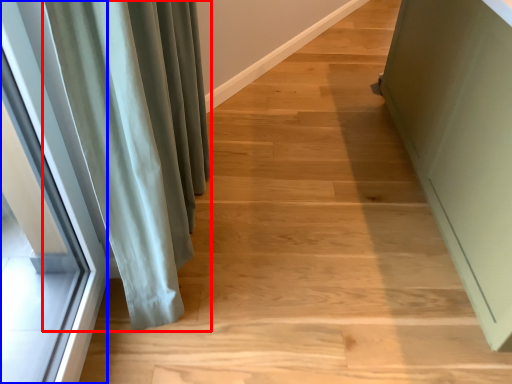
Question: Which of the following is the closest to the observer, curtain (highlighted by a red box) or window (highlighted by a blue box)?

Choices:
 (A) curtain
 (B) window

Answer: (B)